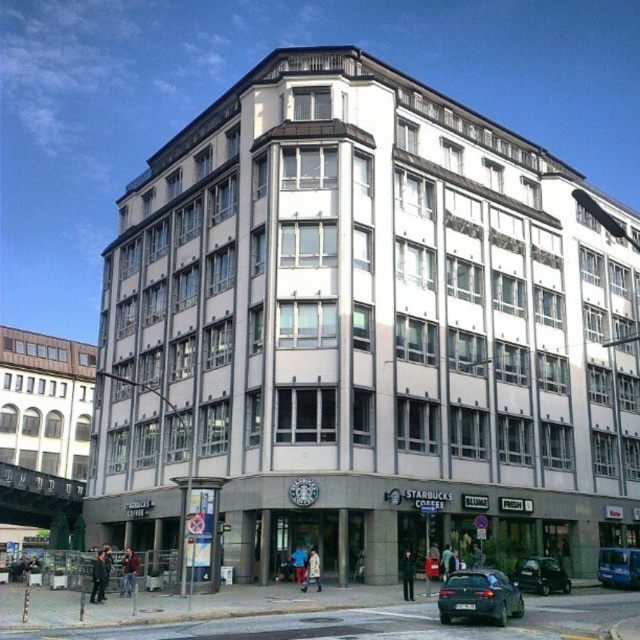
Between point (474, 616) and point (632, 577), which one is positioned behind?

Point (632, 577)

The width and height of the screenshot is (640, 640). In order to click on shiny black sedan at center in this screenshot , I will do `click(480, 596)`.

Locate an element on the screen. This screenshot has width=640, height=640. shiny black sedan at center is located at coordinates (480, 596).

Which is below, shiny black car at center or blue metallic van at center?

blue metallic van at center is lower down.

Can you confirm if shiny black car at center is wider than blue metallic van at center?

No.

Which is in front, point (544, 557) or point (618, 573)?

Point (544, 557) is more forward.

In order to click on shiny black car at center in this screenshot , I will do `click(540, 576)`.

Is shiny black sedan at center positioned behind shiny black car at center?

No, it is in front of shiny black car at center.

Does shiny black sedan at center have a greater width compared to shiny black car at center?

Correct, the width of shiny black sedan at center exceeds that of shiny black car at center.

Does point (451, 584) come in front of point (529, 556)?

Yes, point (451, 584) is closer to viewer.

Identify the location of shiny black sedan at center. This screenshot has width=640, height=640. (480, 596).